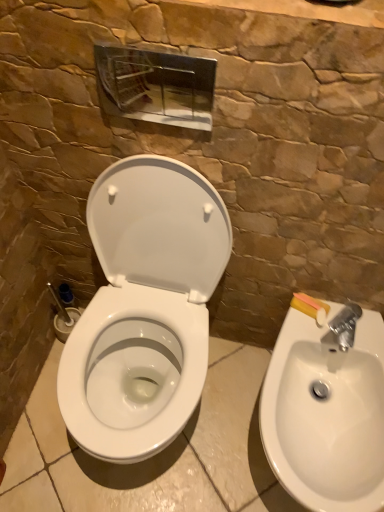
In order to face white glossy toilet at center, should I rotate leftwards or rightwards?

To align with it, rotate left about 6.878°.

Find the location of a particular element. The image size is (384, 512). white glossy toilet at center is located at coordinates (145, 303).

This screenshot has width=384, height=512. Describe the element at coordinates (145, 303) in the screenshot. I see `white glossy toilet at center` at that location.

Describe the element at coordinates (326, 408) in the screenshot. I see `white glossy sink at lower right` at that location.

Locate an element on the screen. The image size is (384, 512). white glossy sink at lower right is located at coordinates (326, 408).

Find the location of a particular element. white glossy toilet at center is located at coordinates (145, 303).

Which is more to the left, white glossy toilet at center or white glossy sink at lower right?

white glossy toilet at center is more to the left.

From the picture: Considering the relative positions of white glossy toilet at center and white glossy sink at lower right in the image provided, is white glossy toilet at center behind white glossy sink at lower right?

No, it is in front of white glossy sink at lower right.

Does point (143, 262) lie behind point (359, 475)?

Yes, point (143, 262) is behind point (359, 475).

From the image's perspective, is white glossy toilet at center positioned above or below white glossy sink at lower right?

white glossy toilet at center is situated higher than white glossy sink at lower right in the image.

From a real-world perspective, which object stands above the other?

In real-world perspective, white glossy toilet at center is above.

Considering the relative sizes of white glossy toilet at center and white glossy sink at lower right in the image provided, is white glossy toilet at center thinner than white glossy sink at lower right?

Yes.

Considering the sizes of objects white glossy toilet at center and white glossy sink at lower right in the image provided, who is shorter, white glossy toilet at center or white glossy sink at lower right?

Standing shorter between the two is white glossy sink at lower right.

Considering the sizes of white glossy toilet at center and white glossy sink at lower right in the image, is white glossy toilet at center bigger or smaller than white glossy sink at lower right?

white glossy toilet at center is bigger than white glossy sink at lower right.

Would you say white glossy toilet at center is outside white glossy sink at lower right?

Indeed, white glossy toilet at center is completely outside white glossy sink at lower right.

Is white glossy toilet at center in contact with white glossy sink at lower right?

No, white glossy toilet at center is not with white glossy sink at lower right.

Is white glossy toilet at center facing towards white glossy sink at lower right?

No, white glossy toilet at center does not turn towards white glossy sink at lower right.

How different are the orientations of white glossy toilet at center and white glossy sink at lower right in degrees?

The angle between the facing direction of white glossy toilet at center and the facing direction of white glossy sink at lower right is 0.000294 degrees.

Where is `toilet on the left of white glossy sink at lower right`? The height and width of the screenshot is (512, 384). toilet on the left of white glossy sink at lower right is located at coordinates (145, 303).

Which object is positioned more to the left, white glossy sink at lower right or white glossy toilet at center?

From the viewer's perspective, white glossy toilet at center appears more on the left side.

Is white glossy sink at lower right in front of or behind white glossy toilet at center in the image?

Visually, white glossy sink at lower right is located behind white glossy toilet at center.

Which point is more distant from viewer, (354, 372) or (100, 390)?

Point (100, 390)

Consider the image. From the image's perspective, which one is positioned higher, white glossy sink at lower right or white glossy toilet at center?

From the image's view, white glossy toilet at center is above.

From a real-world perspective, is white glossy sink at lower right positioned over white glossy toilet at center based on gravity?

No.

Which object is thinner, white glossy sink at lower right or white glossy toilet at center?

white glossy toilet at center.

Considering the relative sizes of white glossy sink at lower right and white glossy toilet at center in the image provided, is white glossy sink at lower right shorter than white glossy toilet at center?

Yes, white glossy sink at lower right is shorter than white glossy toilet at center.

Between white glossy sink at lower right and white glossy toilet at center, which one has larger size?

With larger size is white glossy toilet at center.

Is white glossy toilet at center inside white glossy sink at lower right?

Actually, white glossy toilet at center is outside white glossy sink at lower right.

Is white glossy sink at lower right far from white glossy toilet at center?

No, there isn't a large distance between white glossy sink at lower right and white glossy toilet at center.

From the picture: Is white glossy sink at lower right aimed at white glossy toilet at center?

No, white glossy sink at lower right is not turned towards white glossy toilet at center.

What's the angular difference between white glossy sink at lower right and white glossy toilet at center's facing directions?

The angle between the facing direction of white glossy sink at lower right and the facing direction of white glossy toilet at center is 0.000294 degrees.

You are a GUI agent. You are given a task and a screenshot of the screen. Output one action in this format:
    pyautogui.click(x=<x>, y=<y>)
    Task: Click on the toilet above the white glossy sink at lower right (from the image's perspective)
    
    Given the screenshot: What is the action you would take?
    pyautogui.click(x=145, y=303)

You are a GUI agent. You are given a task and a screenshot of the screen. Output one action in this format:
    pyautogui.click(x=<x>, y=<y>)
    Task: Click on the toilet above the white glossy sink at lower right (from the image's perspective)
    This screenshot has width=384, height=512.
    Given the screenshot: What is the action you would take?
    pyautogui.click(x=145, y=303)

Identify the location of toilet above the white glossy sink at lower right (from a real-world perspective). pyautogui.click(x=145, y=303).